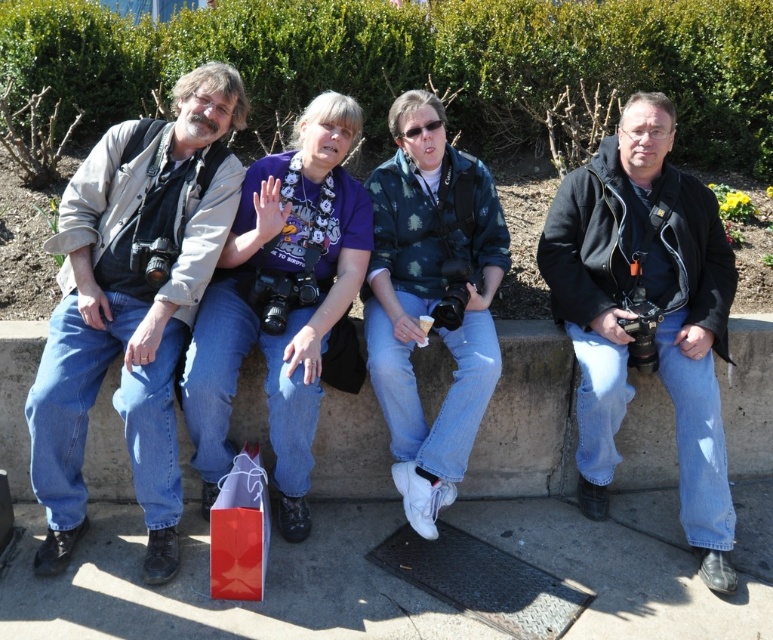
Who is higher up, smooth concrete at lower center or concrete ledge at center?

Positioned higher is concrete ledge at center.

Who is shorter, smooth concrete at lower center or concrete ledge at center?

smooth concrete at lower center is shorter.

The width and height of the screenshot is (773, 640). Describe the element at coordinates (226, 602) in the screenshot. I see `smooth concrete at lower center` at that location.

You are a GUI agent. You are given a task and a screenshot of the screen. Output one action in this format:
    pyautogui.click(x=<x>, y=<y>)
    Task: Click on the smooth concrete at lower center
    
    Given the screenshot: What is the action you would take?
    pyautogui.click(x=226, y=602)

Can you confirm if smooth concrete at lower center is positioned to the left of black matte jacket at center?

Correct, you'll find smooth concrete at lower center to the left of black matte jacket at center.

Can you confirm if smooth concrete at lower center is smaller than black matte jacket at center?

Actually, smooth concrete at lower center might be larger than black matte jacket at center.

Who is more forward, (656, 524) or (628, 348)?

Answer: Point (628, 348) is in front.

Image resolution: width=773 pixels, height=640 pixels. Identify the location of smooth concrete at lower center. (226, 602).

Who is shorter, black matte jacket at center or matte red shopping bag at lower center?

matte red shopping bag at lower center

Locate an element on the screen. Image resolution: width=773 pixels, height=640 pixels. black matte jacket at center is located at coordinates (644, 314).

Identify the location of black matte jacket at center. This screenshot has height=640, width=773. (644, 314).